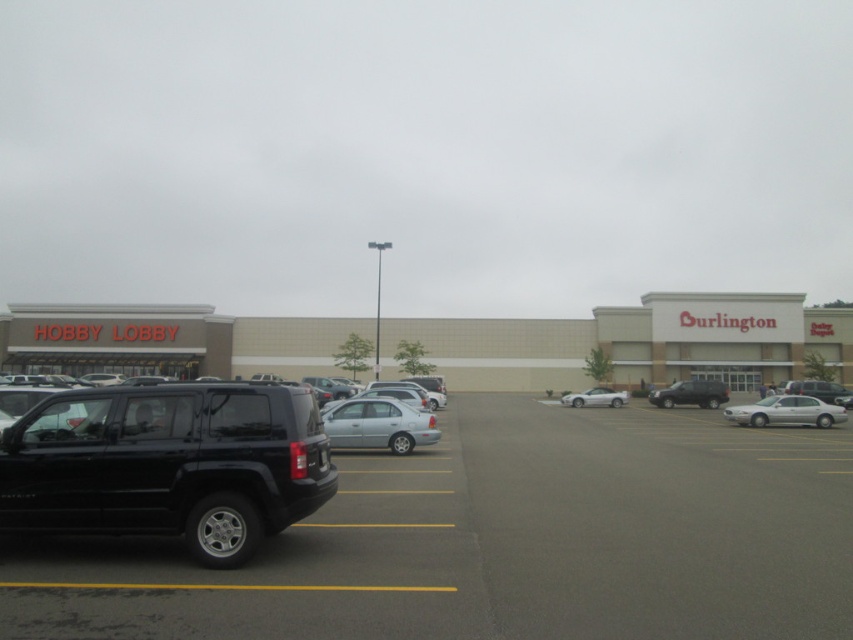
Question: Based on their relative distances, which object is nearer to the black matte suv at lower left?

Choices:
 (A) satin silver sedan at center
 (B) beige/light brown building at center
 (C) matte black suv at center
 (D) matte black suv at right

Answer: (A)

Question: Does black matte suv at lower left appear under white glossy sedan at right?

Choices:
 (A) no
 (B) yes

Answer: (A)

Question: Which of these objects is positioned closest to the matte black suv at center?

Choices:
 (A) black matte suv at left
 (B) beige/light brown building at center
 (C) matte black suv at right

Answer: (C)

Question: Where is beige/light brown building at center located in relation to white glossy sedan at center in the image?

Choices:
 (A) below
 (B) above

Answer: (B)

Question: Which object appears closest to the camera in this image?

Choices:
 (A) black matte suv at left
 (B) matte black suv at right
 (C) matte black suv at center

Answer: (A)

Question: Can you confirm if black matte suv at left is positioned below matte black suv at center?

Choices:
 (A) no
 (B) yes

Answer: (A)